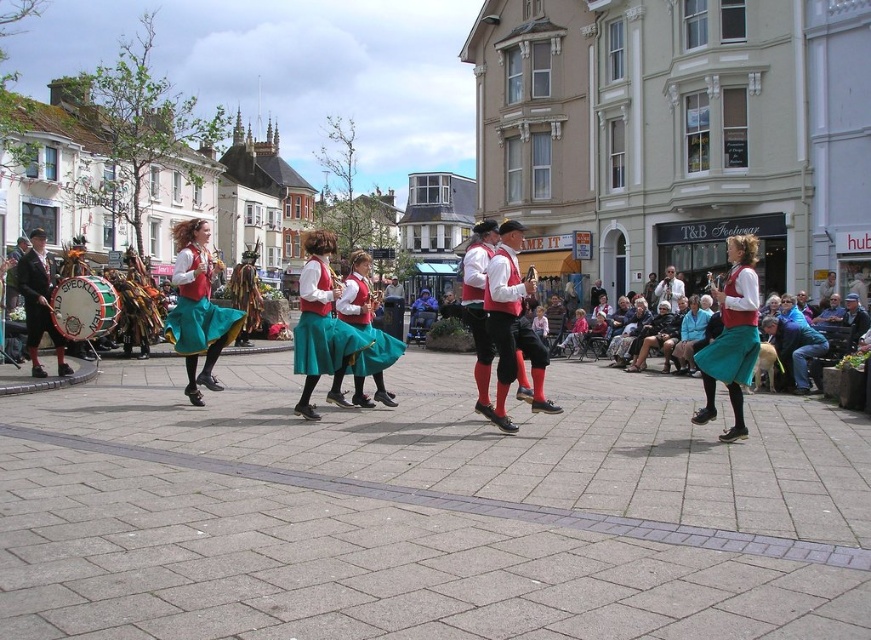
Is matte red skirt at center below matte red vest at center?

Indeed, matte red skirt at center is positioned under matte red vest at center.

Can you confirm if matte red skirt at center is thinner than matte red vest at center?

Yes.

Between point (745, 352) and point (188, 275), which one is positioned in front?

Positioned in front is point (745, 352).

This screenshot has width=871, height=640. Identify the location of matte red skirt at center. (733, 332).

Can you confirm if matte red vest at center is thinner than light brown leather jacket at center?

Incorrect, matte red vest at center's width is not less than light brown leather jacket at center's.

Which is behind, point (208, 324) or point (659, 298)?

Point (659, 298)

Between point (176, 275) and point (670, 288), which one is positioned in front?

Point (176, 275) is more forward.

Identify the location of matte red vest at center. This screenshot has height=640, width=871. (196, 307).

Does teal fabric skirts at center have a larger size compared to green velvet skirt at center?

Indeed, teal fabric skirts at center has a larger size compared to green velvet skirt at center.

Is point (312, 337) positioned in front of point (321, 305)?

Yes, it is in front of point (321, 305).

Measure the distance between point (514,429) and camera.

A distance of 20.34 meters exists between point (514,429) and camera.

Locate an element on the screen. This screenshot has width=871, height=640. teal fabric skirts at center is located at coordinates (200, 376).